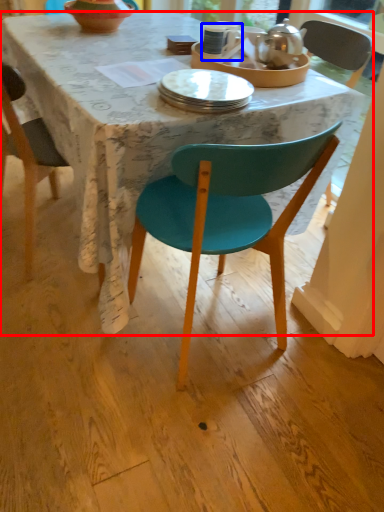
Question: Which object appears closest to the camera in this image, desk (highlighted by a red box) or coffee cup (highlighted by a blue box)?

Choices:
 (A) desk
 (B) coffee cup

Answer: (A)